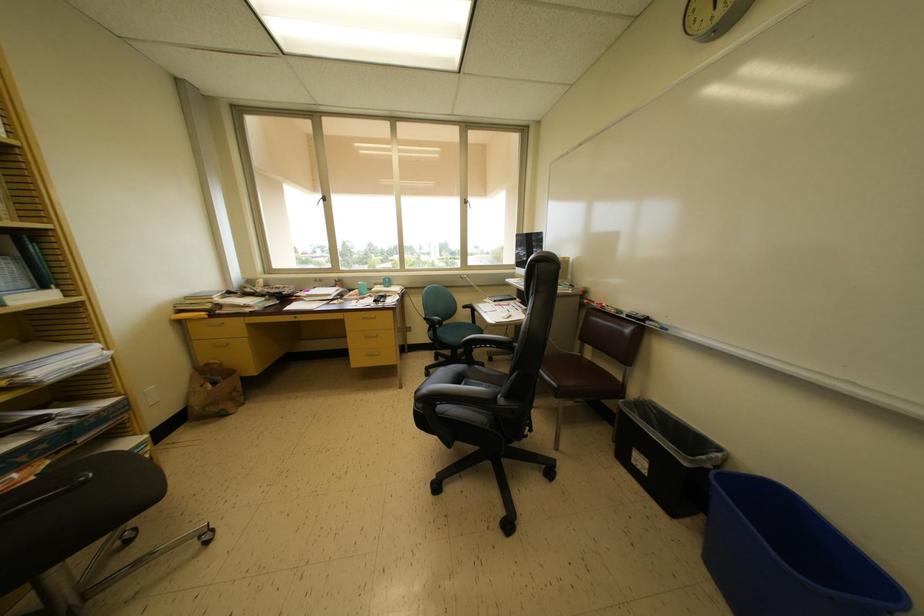
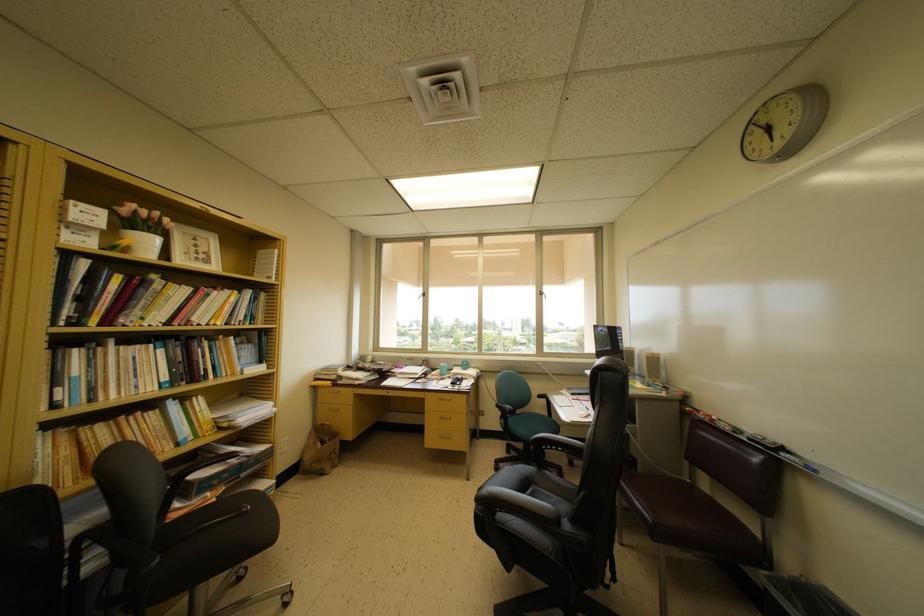
Where in the second image is the point corresponding to point (372, 312) from the first image?

(451, 394)